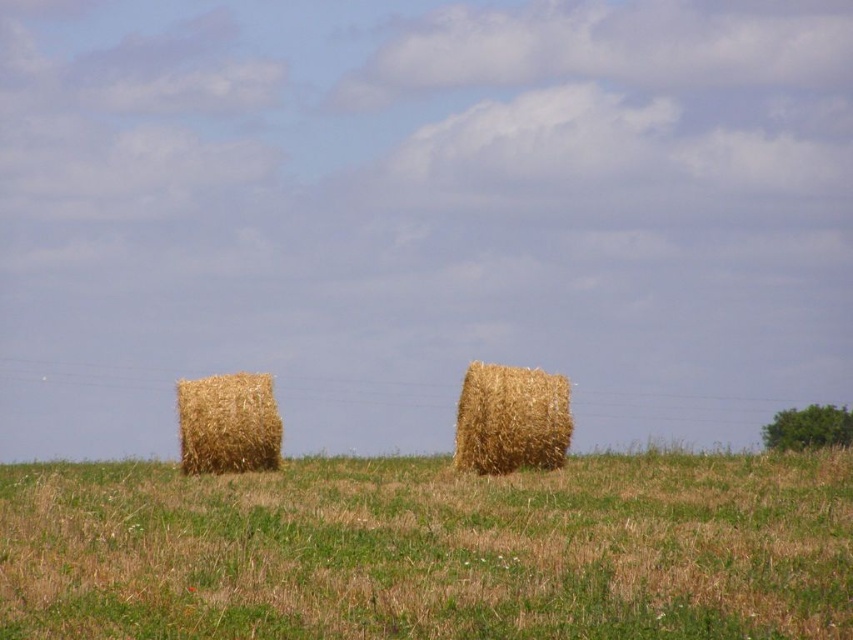
Which is more to the right, brown straw bales at center or golden straw bale at left?

brown straw bales at center is more to the right.

Does brown straw bales at center have a larger size compared to golden straw bale at left?

Yes, brown straw bales at center is bigger than golden straw bale at left.

At what (x,y) coordinates should I click in order to perform the action: click on brown straw bales at center. Please return your answer as a coordinate pair (x, y). This screenshot has height=640, width=853. Looking at the image, I should click on (431, 550).

Find the location of a particular element. Image resolution: width=853 pixels, height=640 pixels. golden straw bale at center is located at coordinates (511, 419).

Who is higher up, golden straw bale at center or golden straw bale at left?

Positioned higher is golden straw bale at center.

This screenshot has height=640, width=853. What do you see at coordinates (511, 419) in the screenshot? I see `golden straw bale at center` at bounding box center [511, 419].

The image size is (853, 640). I want to click on golden straw bale at center, so click(511, 419).

Is the position of brown straw bales at center less distant than that of golden straw bale at center?

Yes, it is.

The width and height of the screenshot is (853, 640). In order to click on brown straw bales at center in this screenshot , I will do `click(431, 550)`.

Identify the location of brown straw bales at center. Image resolution: width=853 pixels, height=640 pixels. (431, 550).